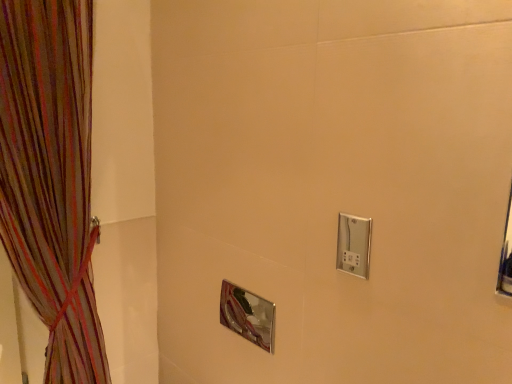
Question: Is polished chrome mirror at center at the left side of satin nickel switch at upper right?

Choices:
 (A) yes
 (B) no

Answer: (A)

Question: Does polished chrome mirror at center turn towards satin nickel switch at upper right?

Choices:
 (A) yes
 (B) no

Answer: (B)

Question: Does polished chrome mirror at center have a greater width compared to satin nickel switch at upper right?

Choices:
 (A) yes
 (B) no

Answer: (A)

Question: Can you confirm if polished chrome mirror at center is smaller than satin nickel switch at upper right?

Choices:
 (A) yes
 (B) no

Answer: (B)

Question: Does polished chrome mirror at center come in front of satin nickel switch at upper right?

Choices:
 (A) yes
 (B) no

Answer: (B)

Question: Is polished chrome mirror at center to the right of satin nickel switch at upper right from the viewer's perspective?

Choices:
 (A) yes
 (B) no

Answer: (B)

Question: Would you say satin nickel switch at upper right is outside polished chrome mirror at center?

Choices:
 (A) yes
 (B) no

Answer: (A)

Question: Is the depth of satin nickel switch at upper right greater than that of polished chrome mirror at center?

Choices:
 (A) yes
 (B) no

Answer: (B)

Question: Considering the relative sizes of satin nickel switch at upper right and polished chrome mirror at center in the image provided, is satin nickel switch at upper right wider than polished chrome mirror at center?

Choices:
 (A) yes
 (B) no

Answer: (B)

Question: Are satin nickel switch at upper right and polished chrome mirror at center located far from each other?

Choices:
 (A) yes
 (B) no

Answer: (B)

Question: Does satin nickel switch at upper right have a larger size compared to polished chrome mirror at center?

Choices:
 (A) yes
 (B) no

Answer: (B)

Question: From a real-world perspective, is satin nickel switch at upper right on polished chrome mirror at center?

Choices:
 (A) no
 (B) yes

Answer: (B)

Question: Is satin nickel switch at upper right thinner than multicolored sheer curtain at left?

Choices:
 (A) no
 (B) yes

Answer: (B)